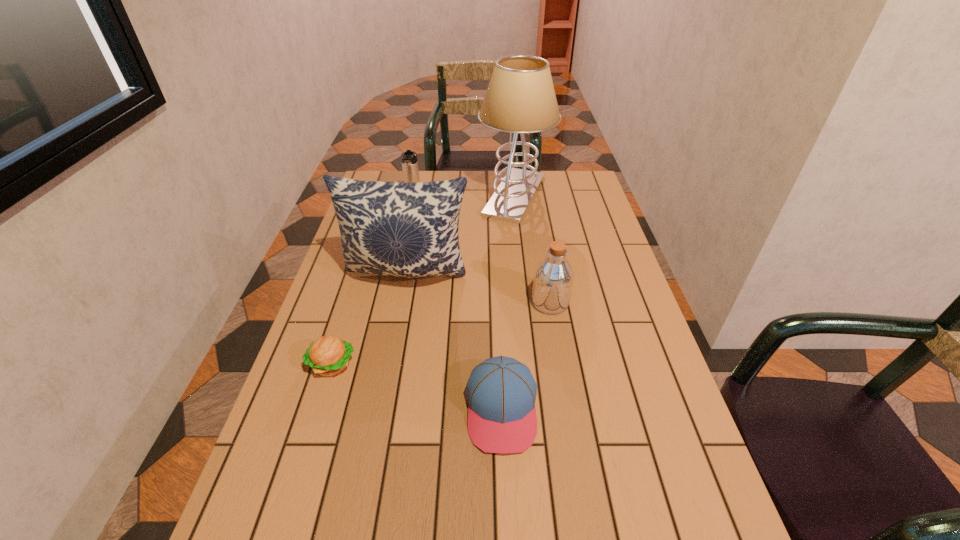
This screenshot has width=960, height=540. Find the location of `unoccupied position between the second tallest object and the bottle`. unoccupied position between the second tallest object and the bottle is located at coordinates coord(479,288).

This screenshot has height=540, width=960. I want to click on free space between the shortest object and the baseball cap, so click(x=417, y=387).

I want to click on vacant area that lies between the cushion and the bottle, so click(479, 288).

The height and width of the screenshot is (540, 960). What are the coordinates of `free space that is in between the thermos bottle and the hamburger` in the screenshot? It's located at (372, 284).

The image size is (960, 540). Identify the location of free space between the shortest object and the thermos bottle. (372, 284).

Find the location of a particular element. The width and height of the screenshot is (960, 540). blank region between the second tallest object and the shortest object is located at coordinates (370, 319).

This screenshot has width=960, height=540. I want to click on free spot between the table lamp and the cushion, so click(x=461, y=235).

What are the coordinates of `the second closest object relative to the bottle` in the screenshot? It's located at (501, 391).

What are the coordinates of `object that is the fourth closest one to the cushion` in the screenshot? It's located at (501, 391).